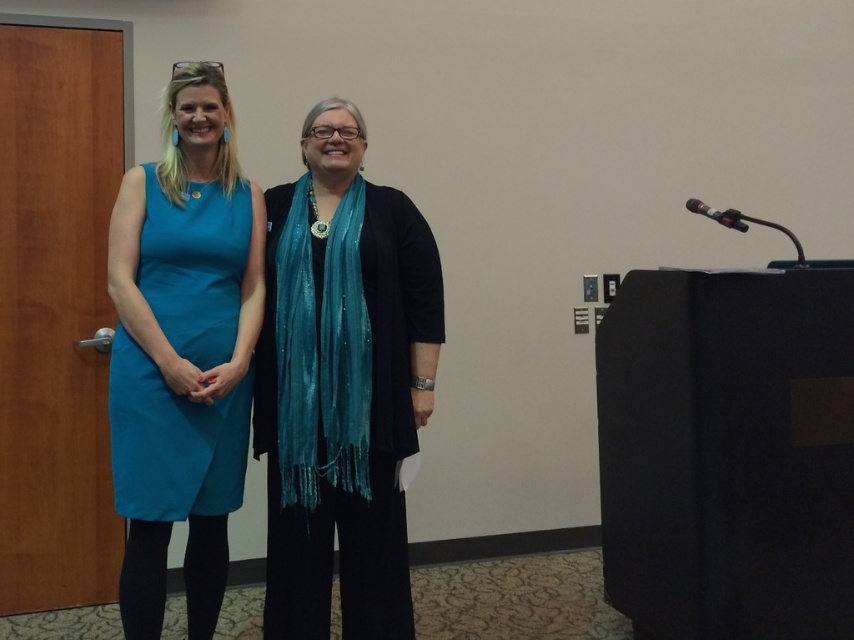
Where is the teal fabric dress at left located in the image?

The teal fabric dress at left is located at point (173, 442) in the image.

You are a photographer at a formal event. You need to adjust the lighting so that the teal fabric dress at left is visible without being overshadowed by the shiny teal scarf at center. Which object should you focus the light on to ensure the dress is properly lit?

The teal fabric dress at left is behind the shiny teal scarf at center, so you should focus the light on the teal fabric dress at left to ensure it is properly lit and not overshadowed by the scarf.